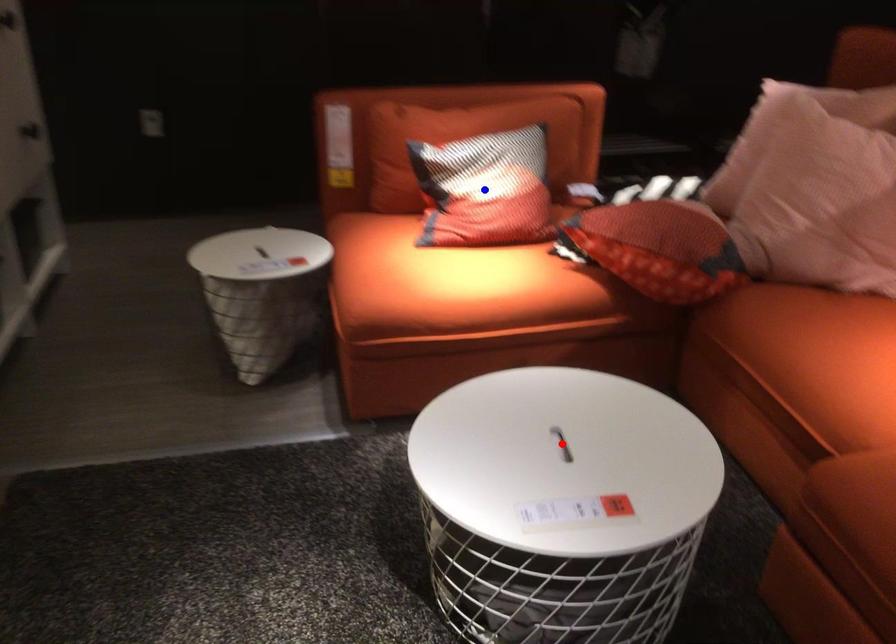
Question: Which of the two points in the image is closer to the camera?

Choices:
 (A) Blue point is closer.
 (B) Red point is closer.

Answer: (B)